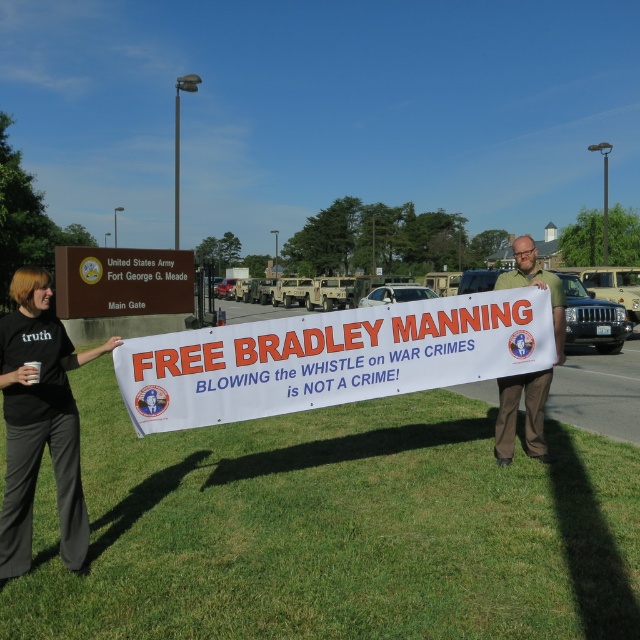
You are a photographer trying to capture the protest scene. You notice the white paper banner at center and the green fabric sign at center. Which object will appear wider in your photo?

The white paper banner at center will appear wider in the photo since its width surpasses that of the green fabric sign at center.

You are a photographer standing at the edge of the protest area. You want to capture a photo that includes both the green grass at lower center and the white fabric banner at center. Based on their positions, which object should appear lower in the photo?

The green grass at lower center appears lower in the photo because it is positioned below the white fabric banner at center.